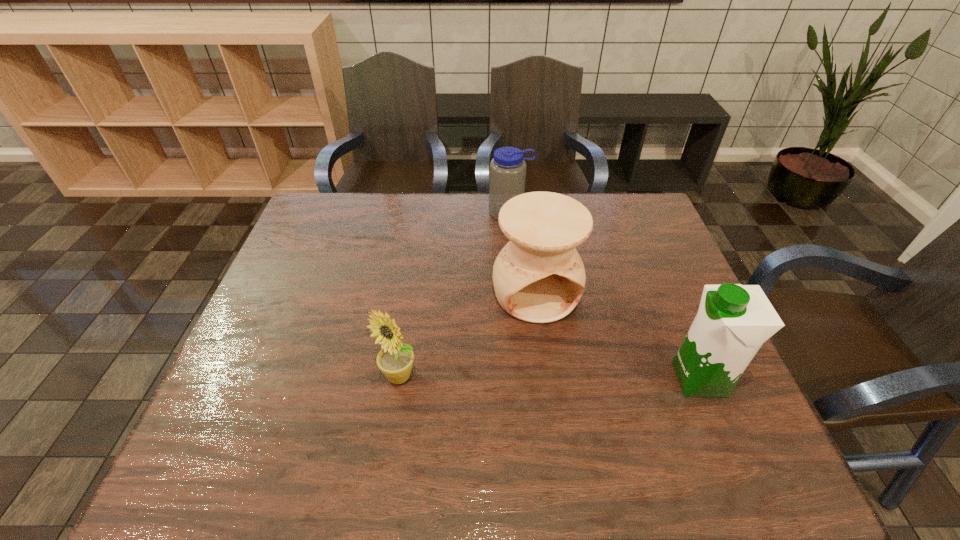
The height and width of the screenshot is (540, 960). Find the location of `free space that is in between the farthest object and the soya milk`. free space that is in between the farthest object and the soya milk is located at coordinates (605, 296).

I want to click on empty space that is in between the farthest object and the leftmost object, so click(x=454, y=295).

Choose which object is the third nearest neighbor to the leftmost object. Please provide its 2D coordinates. Your answer should be formatted as a tuple, i.e. [(x, y)], where the tuple contains the x and y coordinates of a point satisfying the conditions above.

[(733, 321)]

Choose which object is the second nearest neighbor to the third nearest object. Please provide its 2D coordinates. Your answer should be formatted as a tuple, i.e. [(x, y)], where the tuple contains the x and y coordinates of a point satisfying the conditions above.

[(507, 170)]

I want to click on free space that satisfies the following two spatial constraints: 1. on the face of the rightmost object; 2. on the front-facing side of the leftmost object, so click(x=398, y=379).

At what (x,y) coordinates should I click in order to perform the action: click on free spot that satisfies the following two spatial constraints: 1. on the face of the leftmost object; 2. on the front-facing side of the rightmost object. Please return your answer as a coordinate pair (x, y). The height and width of the screenshot is (540, 960). Looking at the image, I should click on (398, 379).

At what (x,y) coordinates should I click in order to perform the action: click on free space that satisfies the following two spatial constraints: 1. on the front side of the soya milk; 2. on the front-facing side of the second farthest object. Please return your answer as a coordinate pair (x, y). This screenshot has width=960, height=540. Looking at the image, I should click on (547, 379).

You are a GUI agent. You are given a task and a screenshot of the screen. Output one action in this format:
    pyautogui.click(x=<x>, y=<y>)
    Task: Click on the free location that satisfies the following two spatial constraints: 1. on the front side of the farthest object; 2. on the front-facing side of the rightmost object
    This screenshot has width=960, height=540.
    Given the screenshot: What is the action you would take?
    pyautogui.click(x=523, y=379)

This screenshot has height=540, width=960. Identify the location of vacant area that satisfies the following two spatial constraints: 1. on the face of the soya milk; 2. on the front-facing side of the sunflower. (398, 379).

You are a GUI agent. You are given a task and a screenshot of the screen. Output one action in this format:
    pyautogui.click(x=<x>, y=<y>)
    Task: Click on the free spot that satisfies the following two spatial constraints: 1. on the front side of the second farthest object; 2. on the front-facing side of the rightmost object
    
    Given the screenshot: What is the action you would take?
    pyautogui.click(x=547, y=379)